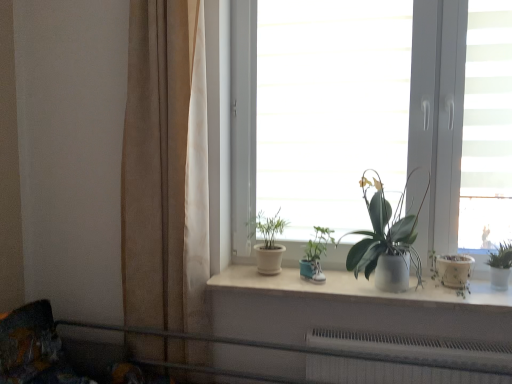
This screenshot has width=512, height=384. I want to click on vacant space underneath matte white pot at center, marked as the fourth houseplant in a right-to-left arrangement (from a real-world perspective), so click(268, 271).